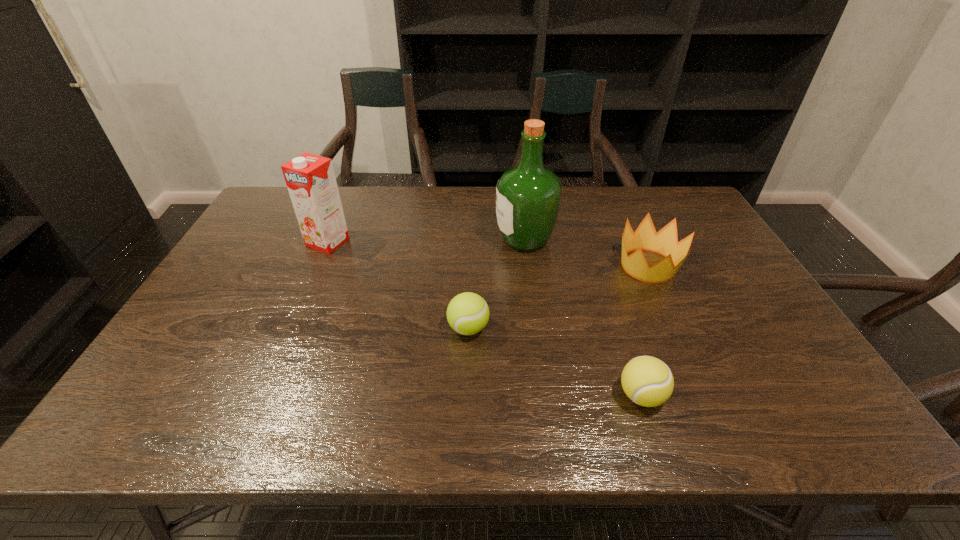
Image resolution: width=960 pixels, height=540 pixels. I want to click on the third object from right to left, so click(528, 196).

This screenshot has height=540, width=960. I want to click on liquor, so click(528, 196).

Find the location of `the leftmost object`. the leftmost object is located at coordinates (310, 179).

This screenshot has width=960, height=540. In order to click on carton in this screenshot , I will do `click(310, 179)`.

Identify the location of crown. Image resolution: width=960 pixels, height=540 pixels. (665, 242).

This screenshot has height=540, width=960. What are the coordinates of `the second nearest object` in the screenshot? It's located at (468, 313).

The image size is (960, 540). I want to click on the farther tennis ball, so click(x=468, y=313).

You are a GUI agent. You are given a task and a screenshot of the screen. Output one action in this format:
    pyautogui.click(x=<x>, y=<y>)
    Task: Click on the nearer tennis ball
    The image size is (960, 540).
    Given the screenshot: What is the action you would take?
    pyautogui.click(x=647, y=381)

I want to click on the right tennis ball, so click(647, 381).

This screenshot has height=540, width=960. What are the coordinates of `vacant space located 0.230m on the front-facing side of the liquor` in the screenshot? It's located at (422, 240).